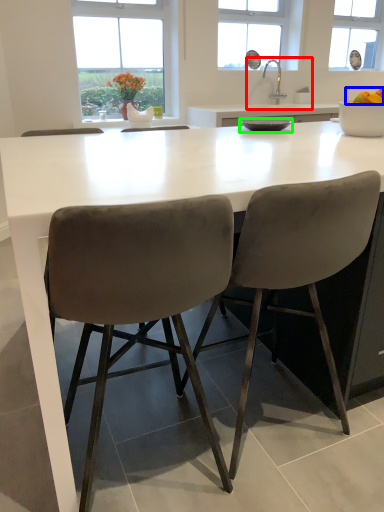
Question: Which object is positioned farthest from sink (highlighted by a red box)? Select from food (highlighted by a blue box) and bowl (highlighted by a green box).

Choices:
 (A) food
 (B) bowl

Answer: (A)